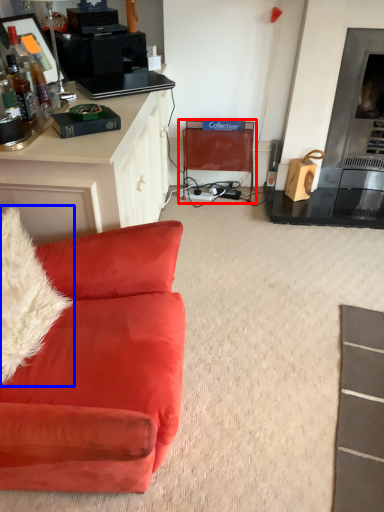
Question: Among these objects, which one is nearest to the camera, swivel chair (highlighted by a red box) or pillow (highlighted by a blue box)?

Choices:
 (A) swivel chair
 (B) pillow

Answer: (B)